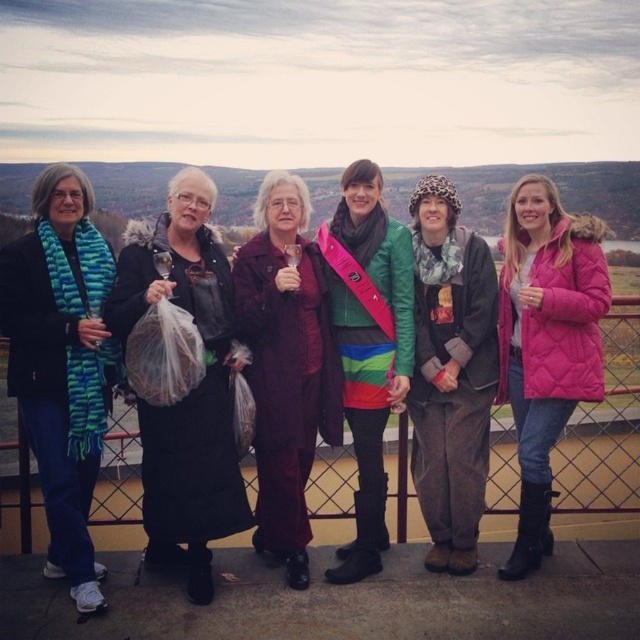
Can you confirm if pink quilted jacket at right is bigger than leopard print scarf at center?

Yes, pink quilted jacket at right is bigger than leopard print scarf at center.

Is point (513, 221) in front of point (474, 356)?

No, (513, 221) is behind (474, 356).

Identify the location of pink quilted jacket at right. This screenshot has width=640, height=640. (547, 342).

Where is `pink quilted jacket at right`? pink quilted jacket at right is located at coordinates tap(547, 342).

Who is lower down, velvet maroon dress at center or leopard print scarf at center?

velvet maroon dress at center

Locate an element on the screen. Image resolution: width=640 pixels, height=640 pixels. velvet maroon dress at center is located at coordinates (285, 365).

The width and height of the screenshot is (640, 640). Find the location of `velvet maroon dress at center`. velvet maroon dress at center is located at coordinates (285, 365).

Is velvet maroon dress at center bigger than multicolored striped skirt at center?

Yes.

At what (x,y) coordinates should I click in order to perform the action: click on velvet maroon dress at center. Please return your answer as a coordinate pair (x, y). This screenshot has height=640, width=640. Looking at the image, I should click on (285, 365).

Where is `velvet maroon dress at center`? This screenshot has width=640, height=640. velvet maroon dress at center is located at coordinates (x=285, y=365).